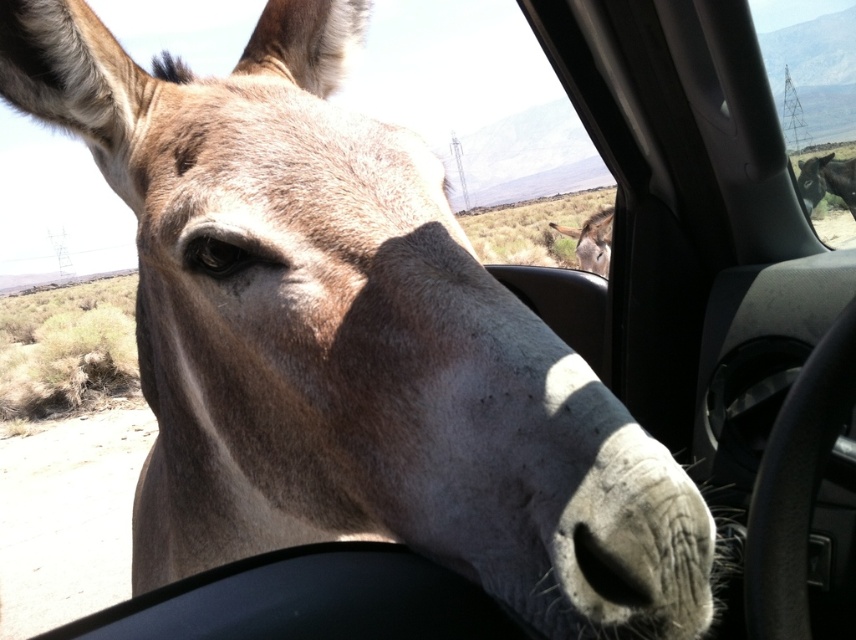
You are a passenger in the vehicle and want to pet both the dark brown fur mule at upper right and the fuzzy brown mule at center. Which mule should you reach for first if you want to touch the one closer to your head?

The dark brown fur mule at upper right is above the fuzzy brown mule at center, so it is closer to your head. You should reach for the dark brown fur mule at upper right first.

You are a passenger in the vehicle and notice the transparent glass donkey at upper right and the dark brown fur mule at upper right. Which one is closer to you?

The transparent glass donkey at upper right is closer to you because it is in front of the dark brown fur mule at upper right.

You are a farmer checking the size of your mules. You have a dark brown fur mule at upper right and a fuzzy brown mule at center. Which mule is bigger?

The dark brown fur mule at upper right is larger in size compared to the fuzzy brown mule at center.